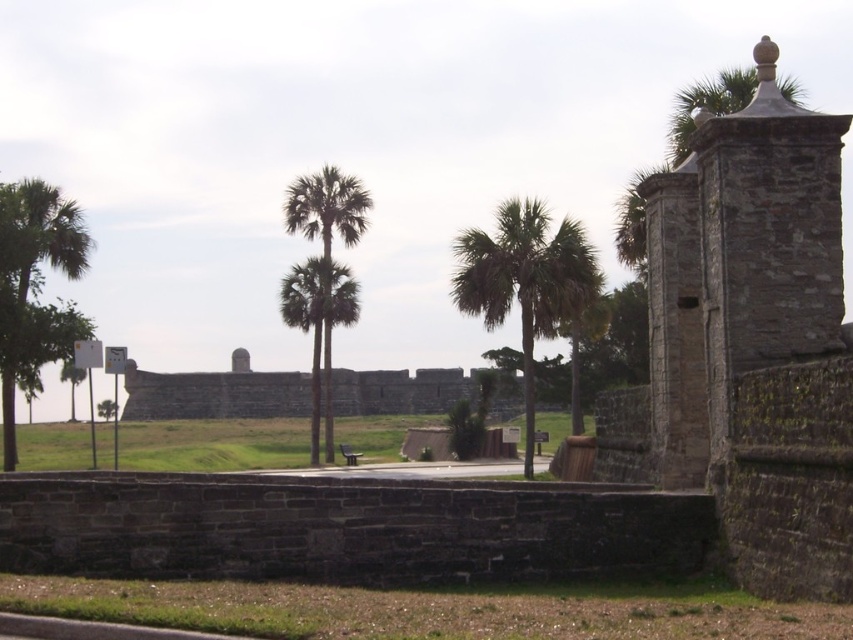
Who is higher up, green leafy palm tree at left or green leafy palm trees at center?

Positioned higher is green leafy palm trees at center.

Between green leafy palm tree at left and green leafy palm trees at center, which one appears on the right side from the viewer's perspective?

From the viewer's perspective, green leafy palm trees at center appears more on the right side.

What do you see at coordinates (35, 289) in the screenshot?
I see `green leafy palm tree at left` at bounding box center [35, 289].

What are the coordinates of `green leafy palm tree at left` in the screenshot? It's located at (35, 289).

Can you confirm if green leafy palm tree at center is thinner than green leafy palm trees at center?

Indeed, green leafy palm tree at center has a lesser width compared to green leafy palm trees at center.

Image resolution: width=853 pixels, height=640 pixels. Describe the element at coordinates (525, 280) in the screenshot. I see `green leafy palm tree at center` at that location.

Is point (485, 248) farther from camera compared to point (363, 205)?

No, it is not.

Where is `green leafy palm tree at center`? The height and width of the screenshot is (640, 853). green leafy palm tree at center is located at coordinates (525, 280).

Does green leafy palm tree at center have a greater width compared to green leafy palm tree at left?

No, green leafy palm tree at center is not wider than green leafy palm tree at left.

Does green leafy palm tree at center lie in front of green leafy palm tree at left?

Yes.

Find the location of a particular element. green leafy palm tree at center is located at coordinates (525, 280).